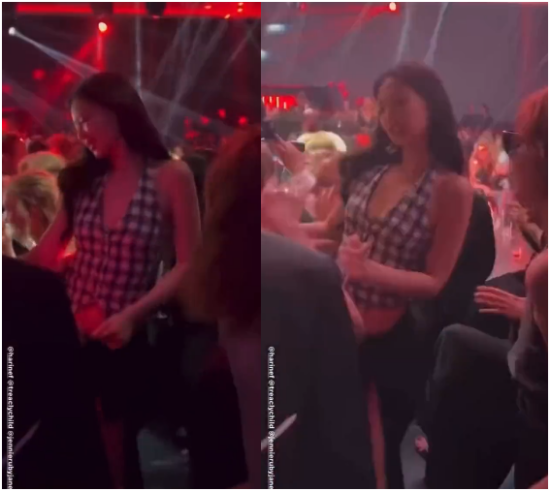
Locate an element on the screen. The image size is (550, 491). floor in right-hand photo is located at coordinates (412, 466).